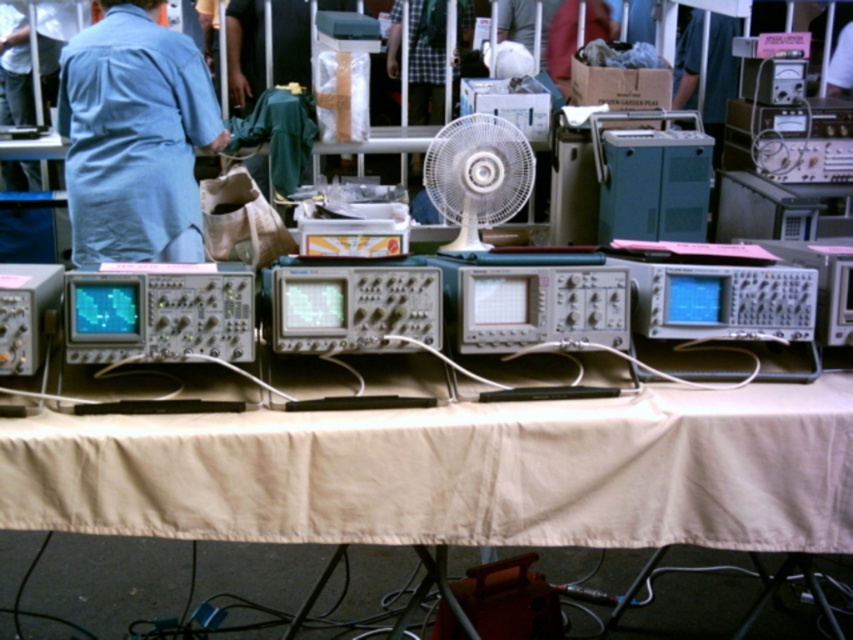
Question: Estimate the real-world distances between objects in this image. Which object is farther from the white plastic fan at center?

Choices:
 (A) beige fabric table at center
 (B) denim shirt at left

Answer: (A)

Question: Is denim shirt at left smaller than white plastic fan at center?

Choices:
 (A) no
 (B) yes

Answer: (A)

Question: Among these objects, which one is farthest from the camera?

Choices:
 (A) white plastic fan at center
 (B) denim shirt at left

Answer: (A)

Question: Which point is farther to the camera?

Choices:
 (A) (479, 244)
 (B) (77, 426)
 (C) (161, 176)

Answer: (A)

Question: Can you confirm if beige fabric table at center is positioned to the left of white plastic fan at center?

Choices:
 (A) no
 (B) yes

Answer: (B)

Question: Does beige fabric table at center have a larger size compared to white plastic fan at center?

Choices:
 (A) yes
 (B) no

Answer: (A)